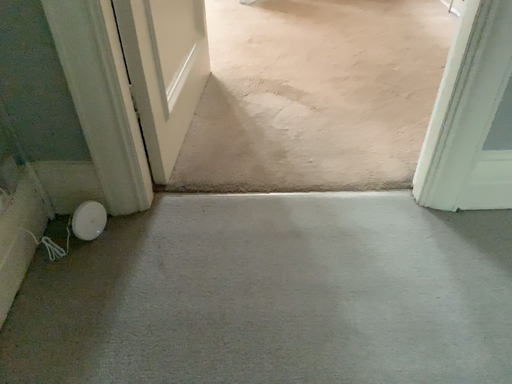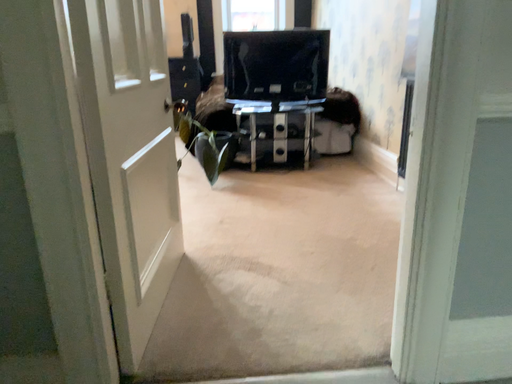
Question: How did the camera likely rotate when shooting the video?

Choices:
 (A) rotated downward
 (B) rotated upward

Answer: (B)